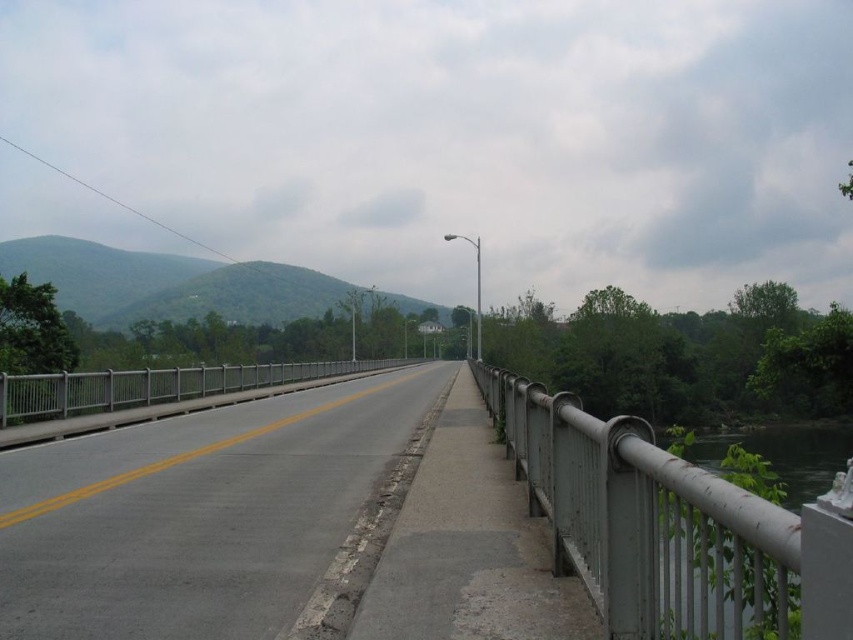
Question: Estimate the real-world distances between objects in this image. Which object is closer to the gray asphalt highway at center?

Choices:
 (A) green metallic railing at right
 (B) metallic gray railing at right
 (C) green leafy mountain at upper left

Answer: (B)

Question: Can you confirm if gray asphalt highway at center is positioned to the right of green leafy mountain at upper left?

Choices:
 (A) yes
 (B) no

Answer: (A)

Question: Estimate the real-world distances between objects in this image. Which object is farther from the green leafy mountain at upper left?

Choices:
 (A) metallic gray railing at right
 (B) green metallic railing at right
 (C) gray asphalt highway at center

Answer: (C)

Question: In this image, where is gray asphalt highway at center located relative to metallic gray railing at right?

Choices:
 (A) right
 (B) left

Answer: (B)

Question: Can you confirm if gray asphalt highway at center is positioned to the left of metallic gray railing at right?

Choices:
 (A) no
 (B) yes

Answer: (B)

Question: Estimate the real-world distances between objects in this image. Which object is farther from the metallic gray railing at right?

Choices:
 (A) green metallic railing at right
 (B) green leafy mountain at upper left

Answer: (B)